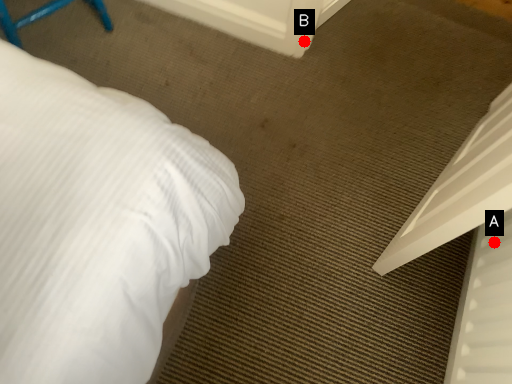
Question: Two points are circled on the image, labeled by A and B beside each circle. Which point is closer to the camera?

Choices:
 (A) A is closer
 (B) B is closer

Answer: (A)